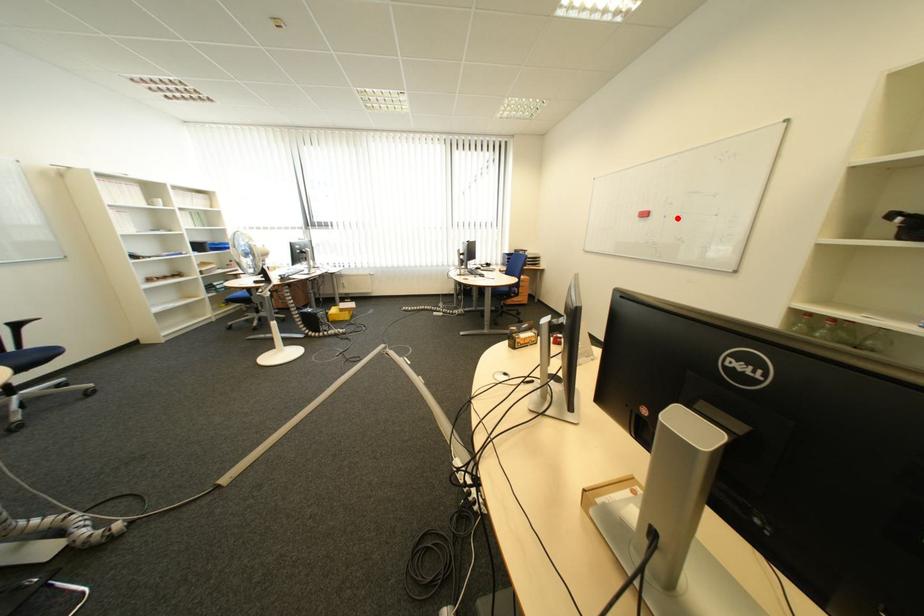
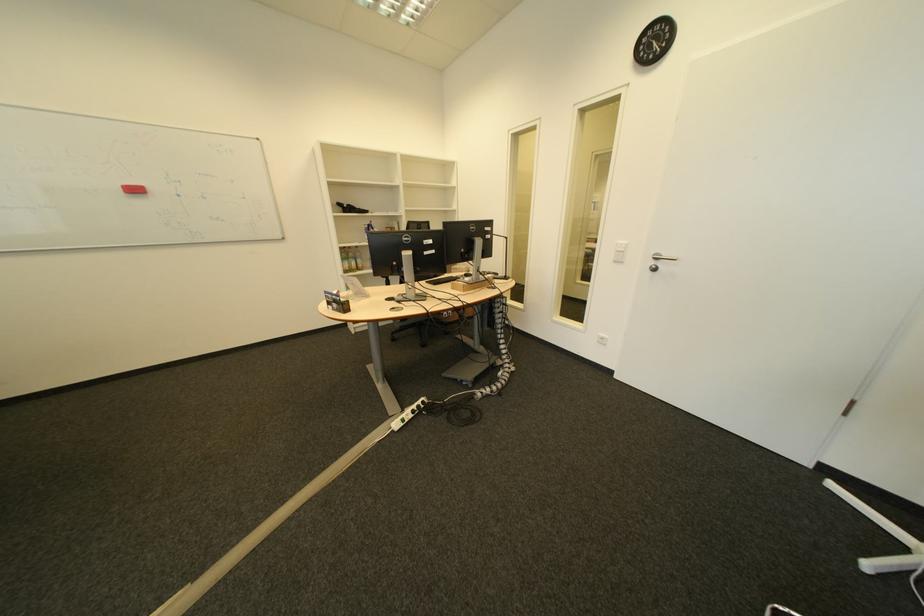
Locate, in the second image, the point that corresponds to the highlighted location in the first image.

(192, 197)